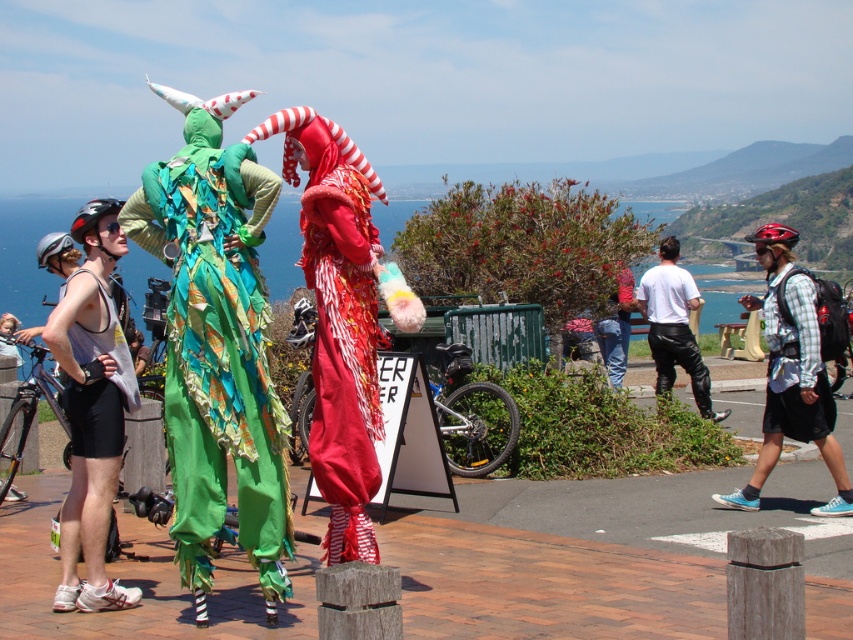
You are a photographer trying to capture the perfect shot of the red satin clown at center. To ensure the clown is in the frame, where should you position your camera relative to the scene?

The red satin clown at center is located at point [338,320], so you should position your camera directly facing the center of the scene to capture the clown in the frame.

You are organizing a parade and need to know the relative sizes of the green fabric dragon at left and the red satin clown at center to arrange them properly. Which one is wider?

The green fabric dragon at left is wider than the red satin clown at center.